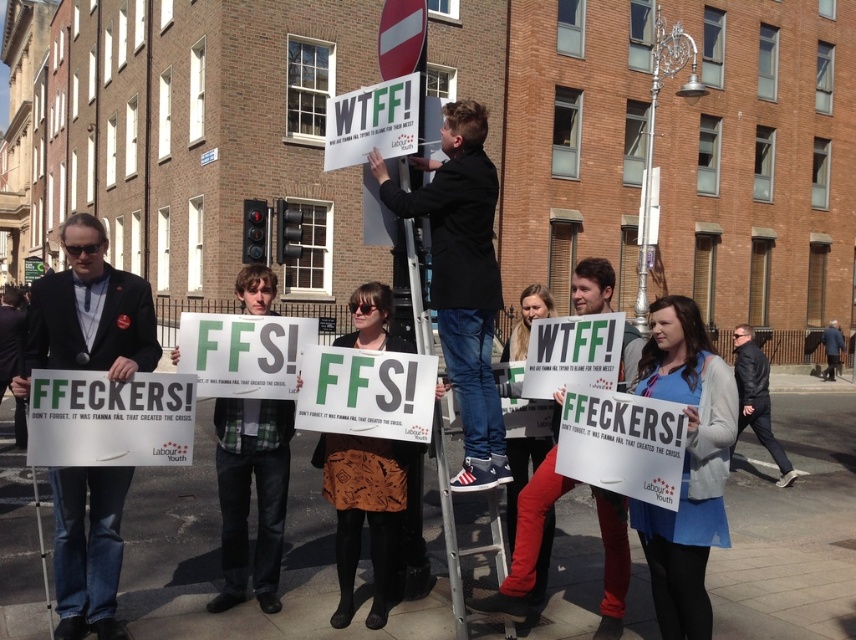
Which of these two, matte black jacket at left or dark blue wool coat at lower right, stands shorter?

With less height is matte black jacket at left.

How distant is matte black jacket at left from dark blue wool coat at lower right?

They are 80.66 feet apart.

Is point (70, 260) closer to camera compared to point (836, 326)?

Yes, it is.

At what (x,y) coordinates should I click in order to perform the action: click on matte black jacket at left. Please return your answer as a coordinate pair (x, y). This screenshot has width=856, height=640. Looking at the image, I should click on (88, 312).

Is matte black jacket at left to the right of white paper sign at upper center from the viewer's perspective?

No, matte black jacket at left is not to the right of white paper sign at upper center.

Which of these two, matte black jacket at left or white paper sign at upper center, stands taller?

With more height is matte black jacket at left.

Where is `matte black jacket at left`? This screenshot has width=856, height=640. matte black jacket at left is located at coordinates (88, 312).

Can you confirm if dark blue jeans at center is wider than white paper sign at lower left?

No, dark blue jeans at center is not wider than white paper sign at lower left.

Does point (486, 276) come farther from viewer compared to point (84, 417)?

Yes, it is.

At what (x,y) coordinates should I click in order to perform the action: click on dark blue jeans at center. Please return your answer as a coordinate pair (x, y). Image resolution: width=856 pixels, height=640 pixels. Looking at the image, I should click on (461, 278).